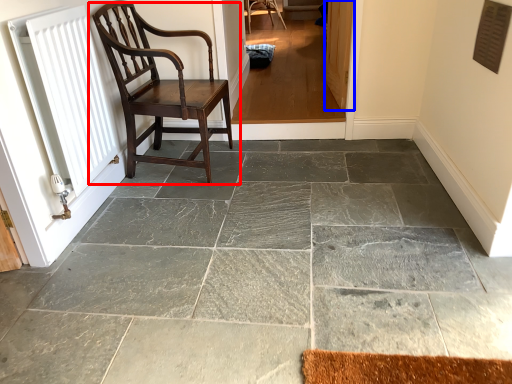
Question: Which object appears closest to the camera in this image, chair (highlighted by a red box) or screen door (highlighted by a blue box)?

Choices:
 (A) chair
 (B) screen door

Answer: (A)